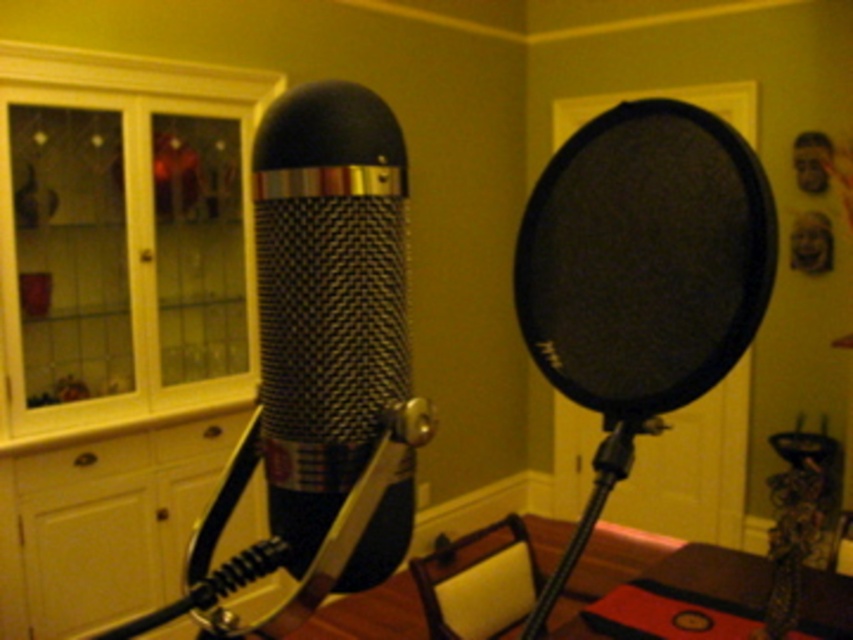
Where is the black mesh speaker at center located in the coordinate system?

The black mesh speaker at center is located at point (x=643, y=257) in the coordinate system.

You are setting up a recording studio and need to place a new device between the black mesh speaker at center and the textured black microphone at center. The device requires at least 10 centimeters of space. Can you determine if there is enough space between them based on their heights?

The black mesh speaker at center is shorter than the textured black microphone at center, but the description does not provide specific measurements of their heights or the distance between them. Therefore, it is impossible to determine if there is enough space for the device requiring 10 centimeters.